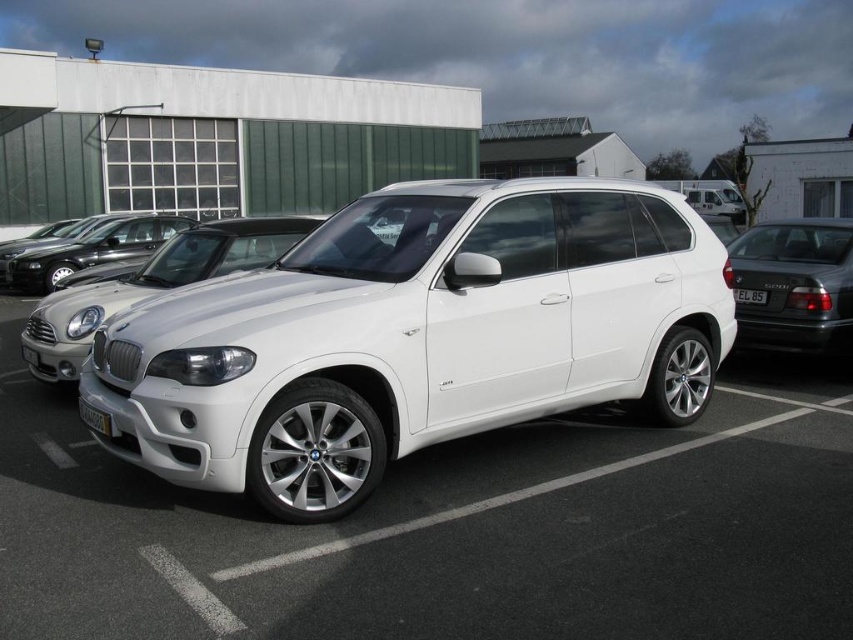
Which is in front, point (270, 422) or point (759, 224)?

Point (270, 422) is in front.

Who is higher up, white metallic suv at center or glossy black car at right?

glossy black car at right is above.

Who is more distant from viewer, (683, 253) or (751, 323)?

The point (751, 323) is behind.

Locate an element on the screen. Image resolution: width=853 pixels, height=640 pixels. white metallic suv at center is located at coordinates (416, 337).

Which is above, glossy black car at right or yellow plastic license plate at lower center?

glossy black car at right

Which is more to the right, glossy black car at right or yellow plastic license plate at lower center?

Positioned to the right is glossy black car at right.

Who is more distant from viewer, (851, 266) or (90, 412)?

Positioned behind is point (851, 266).

This screenshot has height=640, width=853. What are the coordinates of `glossy black car at right` in the screenshot? It's located at (795, 284).

This screenshot has height=640, width=853. What do you see at coordinates (416, 337) in the screenshot?
I see `white metallic suv at center` at bounding box center [416, 337].

What are the coordinates of `white metallic suv at center` in the screenshot? It's located at (416, 337).

Identify the location of white metallic suv at center. (416, 337).